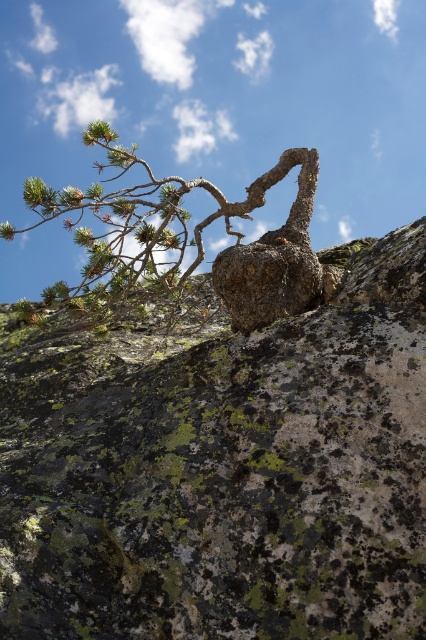
Can you confirm if rough textured rock at upper left is positioned above green textured rock at upper center?

Incorrect, rough textured rock at upper left is not positioned above green textured rock at upper center.

Is point (336, 608) farther from camera compared to point (302, 195)?

No, (336, 608) is closer to viewer.

Where is `rough textured rock at upper left`? The width and height of the screenshot is (426, 640). rough textured rock at upper left is located at coordinates (221, 467).